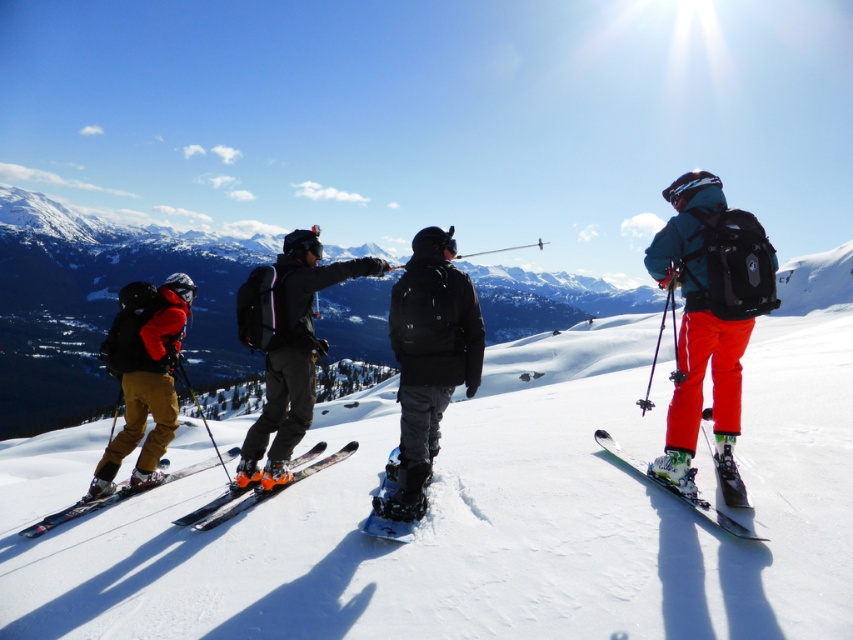
Question: Does white snowboard at center appear over blue matte snowboard at center?

Choices:
 (A) no
 (B) yes

Answer: (A)

Question: Which object appears farthest from the camera in this image?

Choices:
 (A) black matte snowboard at center
 (B) matte black backpack at right

Answer: (A)

Question: Which object is closer to the camera taking this photo?

Choices:
 (A) matte black backpack at left
 (B) matte black ski at center
 (C) black matte snowboard at center
 (D) green matte skis at right

Answer: (D)

Question: Can you confirm if white snowboard at center is positioned to the right of matte black skis at lower left?

Choices:
 (A) yes
 (B) no

Answer: (B)

Question: Which point is closer to the camera?

Choices:
 (A) [x=192, y=289]
 (B) [x=241, y=330]

Answer: (B)

Question: Considering the relative positions of orange metallic skis at center and matte black skis at lower left in the image provided, where is orange metallic skis at center located with respect to matte black skis at lower left?

Choices:
 (A) left
 (B) right

Answer: (B)